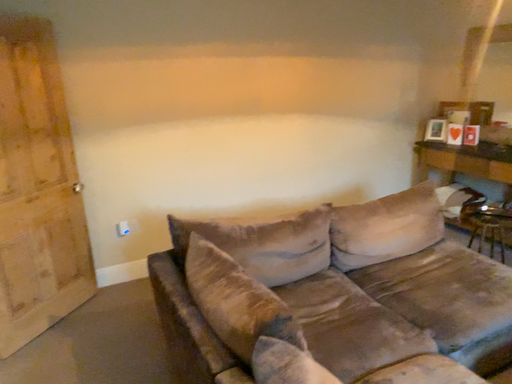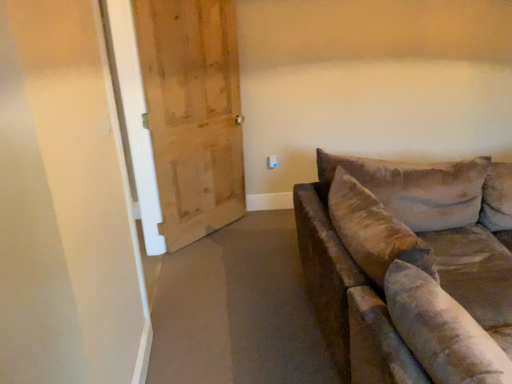
Question: How did the camera likely rotate when shooting the video?

Choices:
 (A) rotated right
 (B) rotated left

Answer: (B)